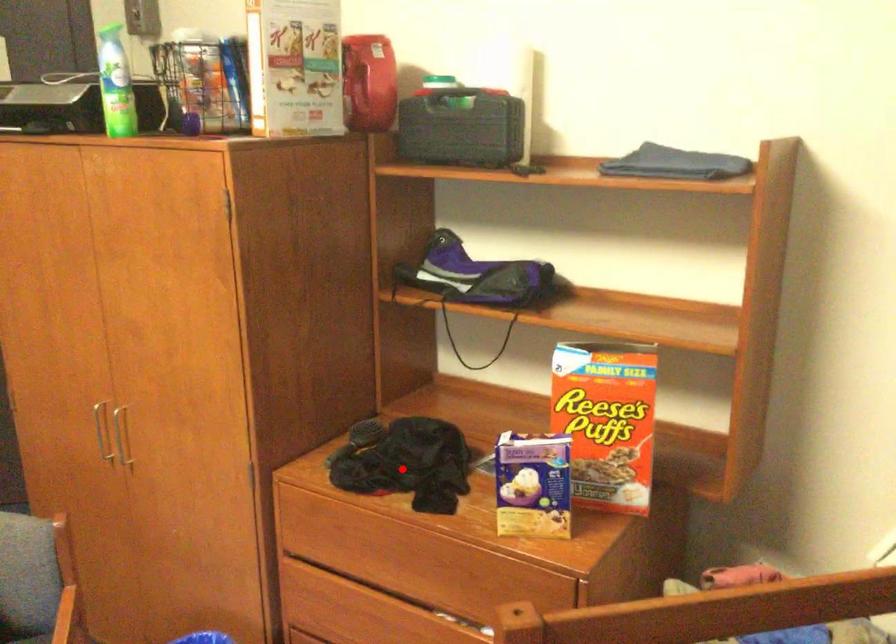
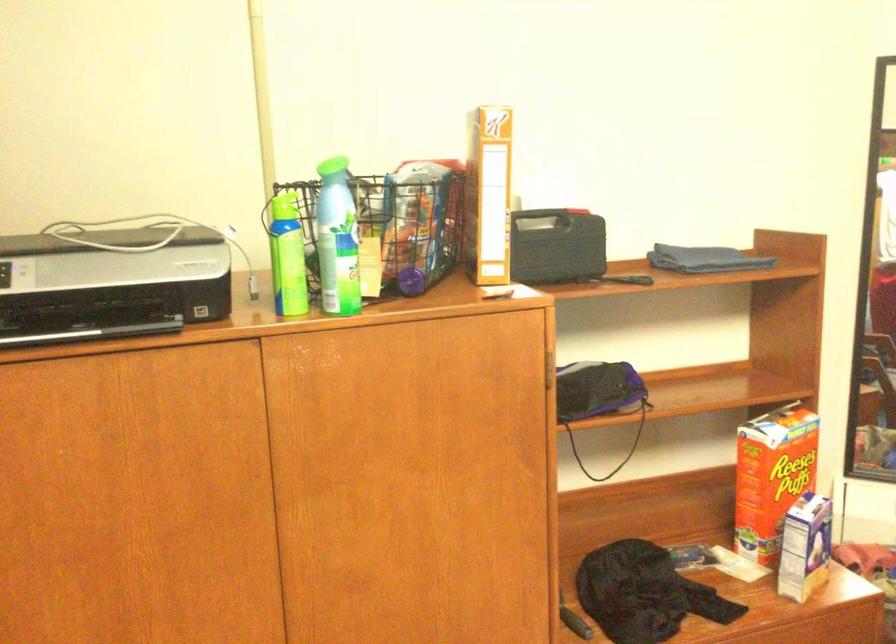
The point at the highlighted location is marked in the first image. Where is the corresponding point in the second image?

(643, 592)